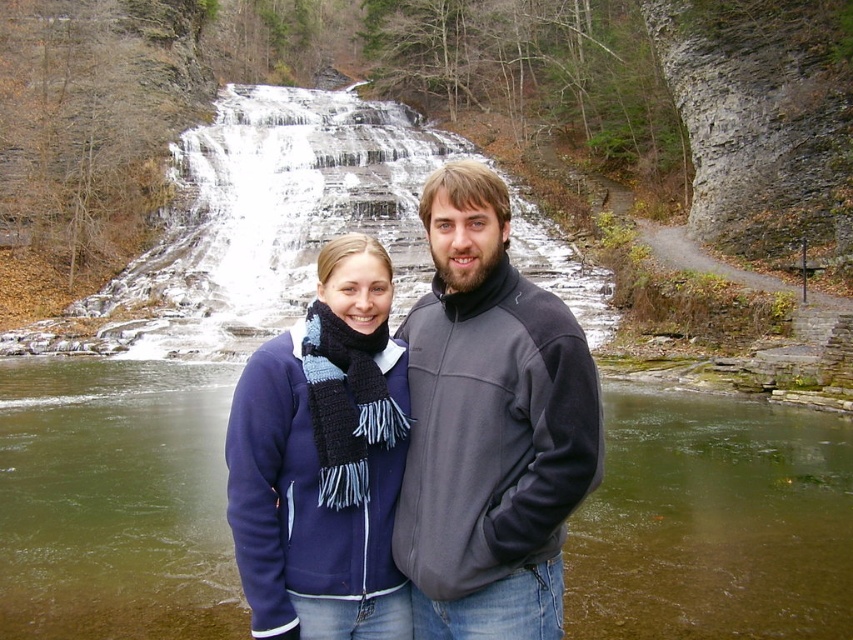
Question: Does gray fleece jacket at center lie in front of blue knitted scarf at center?

Choices:
 (A) no
 (B) yes

Answer: (A)

Question: Which point is closer to the camera?

Choices:
 (A) (780, 500)
 (B) (279, 593)
 (C) (531, 512)

Answer: (B)

Question: Does gray fleece jacket at center have a greater width compared to blue knitted scarf at center?

Choices:
 (A) no
 (B) yes

Answer: (A)

Question: From the image, what is the correct spatial relationship of gray fleece jacket at center in relation to blue knitted scarf at center?

Choices:
 (A) right
 (B) left

Answer: (A)

Question: Which of the following is the closest to the observer?

Choices:
 (A) (438, 404)
 (B) (144, 397)

Answer: (A)

Question: Which of the following is the farthest from the observer?

Choices:
 (A) (78, 429)
 (B) (271, 472)

Answer: (A)